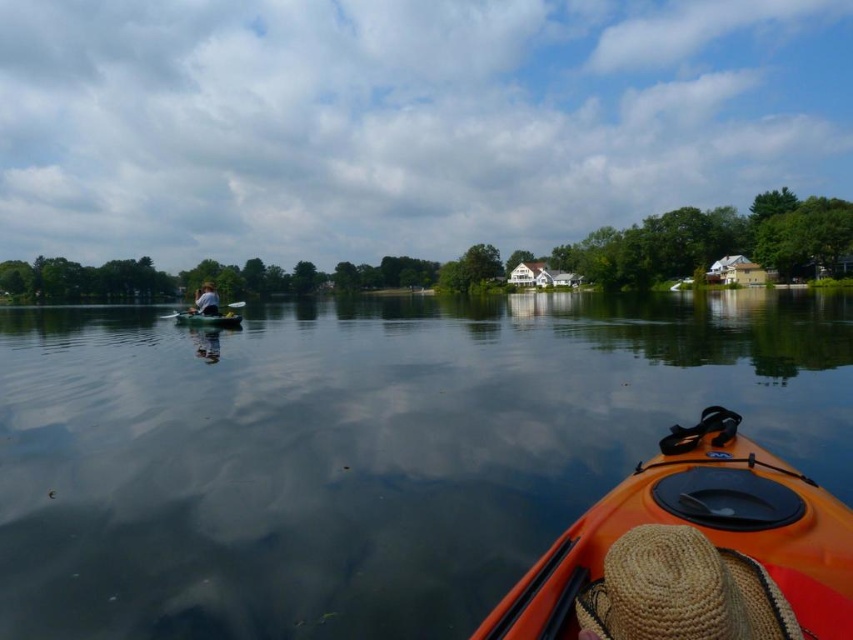
You are sitting in the orange plastic canoe at center and want to reach the wooden paddle at left. Which direction should you paddle to move towards it?

The orange plastic canoe at center is located below the wooden paddle at left, so you should paddle upwards to move towards the wooden paddle at left.

You are in a kayak and need to store your wooden paddle at left. Can you fit it inside the orange matte kayak at lower right without folding it?

The orange matte kayak at lower right is smaller than the wooden paddle at left, so the paddle cannot fit inside the kayak without folding.

You are planning to store the orange plastic canoe at center and the wooden paddle at left in a storage room. The storage room has a shelf that can only hold items with a width of 1 meter or less. Based on the scene description, will both items fit on the shelf?

The orange plastic canoe at center has a lesser width compared to wooden paddle at left. Since the shelf can hold items up to 1 meter wide, but we don not know the exact widths of either item, we cannot determine if they will fit. More information about their actual widths is needed.